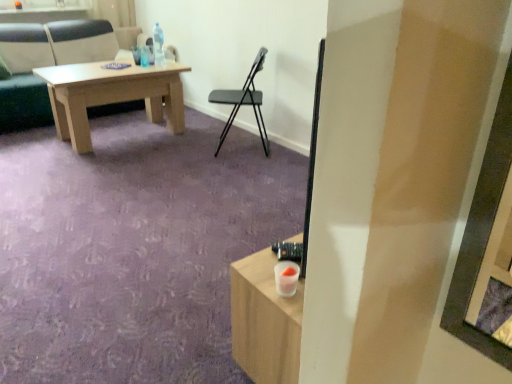
What is the approximate height of clear plastic bottle at upper center?

The height of clear plastic bottle at upper center is 13.22 inches.

Consider the image. Measure the distance between light brown wooden table at upper left, the 1th chair in the left-to-right sequence, and camera.

A distance of 3.62 meters exists between light brown wooden table at upper left, the 1th chair in the left-to-right sequence, and camera.

The height and width of the screenshot is (384, 512). What do you see at coordinates (243, 102) in the screenshot?
I see `black plastic chair at center, placed as the 2th chair when sorted from left to right` at bounding box center [243, 102].

In order to click on clear plastic bottle at upper center in this screenshot , I will do `click(158, 45)`.

From a real-world perspective, starting from the clear plastic bottle at upper center, which chair is the 2nd one below it? Please provide its 2D coordinates.

[(243, 102)]

Is black plastic chair at center, acting as the 1th chair starting from the right, far away from clear plastic bottle at upper center?

black plastic chair at center, acting as the 1th chair starting from the right, is actually quite close to clear plastic bottle at upper center.

How far apart are black plastic chair at center, which ranks as the first chair in front-to-back order, and clear plastic bottle at upper center?

black plastic chair at center, which ranks as the first chair in front-to-back order, is 75.23 centimeters from clear plastic bottle at upper center.

Which of these two, black plastic chair at center, acting as the 1th chair starting from the right, or clear plastic bottle at upper center, is wider?

Wider between the two is black plastic chair at center, acting as the 1th chair starting from the right.

How different are the orientations of light brown wooden table at upper left, which is the 2th chair from right to left, and clear plastic bottle at upper center in degrees?

The facing directions of light brown wooden table at upper left, which is the 2th chair from right to left, and clear plastic bottle at upper center are 1.16 degrees apart.

Is light brown wooden table at upper left, which is the 2th chair from right to left, placed right next to clear plastic bottle at upper center?

No, light brown wooden table at upper left, which is the 2th chair from right to left, is not with clear plastic bottle at upper center.

Looking at this image, between light brown wooden table at upper left, which is the 2th chair from right to left, and clear plastic bottle at upper center, which one has larger size?

With larger size is light brown wooden table at upper left, which is the 2th chair from right to left.

From a real-world perspective, is light brown wooden table at upper left, which is counted as the first chair, starting from the back, under clear plastic bottle at upper center?

Correct, in the physical world, light brown wooden table at upper left, which is counted as the first chair, starting from the back, is lower than clear plastic bottle at upper center.

From the image's perspective, is black plastic chair at center, acting as the 1th chair starting from the right, beneath light brown wooden table at upper left, which is counted as the first chair, starting from the back?

Yes, from the image's perspective, black plastic chair at center, acting as the 1th chair starting from the right, is below light brown wooden table at upper left, which is counted as the first chair, starting from the back.

Is the position of black plastic chair at center, placed as the 2th chair when sorted from left to right, more distant than that of light brown wooden table at upper left, marked as the 2th chair in a front-to-back arrangement?

No, it is in front of light brown wooden table at upper left, marked as the 2th chair in a front-to-back arrangement.

Does black plastic chair at center, placed as the 2th chair when sorted from left to right, have a lesser height compared to light brown wooden table at upper left, the 1th chair in the left-to-right sequence?

Yes, black plastic chair at center, placed as the 2th chair when sorted from left to right, is shorter than light brown wooden table at upper left, the 1th chair in the left-to-right sequence.

Considering the points (154, 42) and (223, 136), which point is in front, point (154, 42) or point (223, 136)?

The point (223, 136) is closer to the camera.

Is the position of clear plastic bottle at upper center more distant than that of black plastic chair at center, which ranks as the first chair in front-to-back order?

That is True.

Considering the relative positions of clear plastic bottle at upper center and black plastic chair at center, placed as the 2th chair when sorted from left to right, in the image provided, is clear plastic bottle at upper center to the right of black plastic chair at center, placed as the 2th chair when sorted from left to right, from the viewer's perspective?

Incorrect, clear plastic bottle at upper center is not on the right side of black plastic chair at center, placed as the 2th chair when sorted from left to right.

Is clear plastic bottle at upper center facing away from black plastic chair at center, placed as the 2th chair when sorted from left to right?

No, clear plastic bottle at upper center is not facing the opposite direction of black plastic chair at center, placed as the 2th chair when sorted from left to right.

Is the depth of light brown wooden table at upper left, which is counted as the first chair, starting from the back, greater than that of black plastic chair at center, acting as the 1th chair starting from the right?

Yes, it is.

Considering the relative sizes of light brown wooden table at upper left, which is the 2th chair from right to left, and black plastic chair at center, the second chair in the back-to-front sequence, in the image provided, is light brown wooden table at upper left, which is the 2th chair from right to left, thinner than black plastic chair at center, the second chair in the back-to-front sequence,?

Incorrect, the width of light brown wooden table at upper left, which is the 2th chair from right to left, is not less than that of black plastic chair at center, the second chair in the back-to-front sequence.

Is light brown wooden table at upper left, which is counted as the first chair, starting from the back, oriented away from black plastic chair at center, placed as the 2th chair when sorted from left to right?

No, light brown wooden table at upper left, which is counted as the first chair, starting from the back, is not facing away from black plastic chair at center, placed as the 2th chair when sorted from left to right.

Find the location of a particular element. chair that is the 1st one below the clear plastic bottle at upper center (from a real-world perspective) is located at coordinates (45, 64).

Between clear plastic bottle at upper center and light brown wooden table at upper left, marked as the 2th chair in a front-to-back arrangement, which one is positioned behind?

Positioned behind is clear plastic bottle at upper center.

Does point (159, 48) appear closer or farther from the camera than point (49, 112)?

Point (159, 48) is positioned closer to the camera compared to point (49, 112).

From a real-world perspective, is clear plastic bottle at upper center above or below light brown wooden table at upper left, which is counted as the first chair, starting from the back?

Clearly, from a real-world perspective, clear plastic bottle at upper center is above light brown wooden table at upper left, which is counted as the first chair, starting from the back.

There is a black plastic chair at center, the second chair in the back-to-front sequence. Where is `bottle above it (from a real-world perspective)`? The height and width of the screenshot is (384, 512). bottle above it (from a real-world perspective) is located at coordinates (158, 45).

What are the coordinates of `bottle that is below the light brown wooden table at upper left, which is counted as the first chair, starting from the back (from the image's perspective)` in the screenshot? It's located at (158, 45).

Which object lies further to the anchor point black plastic chair at center, the second chair in the back-to-front sequence, clear plastic bottle at upper center or light brown wooden table at upper left, the 1th chair in the left-to-right sequence?

light brown wooden table at upper left, the 1th chair in the left-to-right sequence, is further to black plastic chair at center, the second chair in the back-to-front sequence.

Which object lies further to the anchor point black plastic chair at center, acting as the 1th chair starting from the right, light brown wooden table at upper left, which is the 2th chair from right to left, or clear plastic bottle at upper center?

light brown wooden table at upper left, which is the 2th chair from right to left, lies further to black plastic chair at center, acting as the 1th chair starting from the right, than the other object.

From the image, which object appears to be nearer to clear plastic bottle at upper center, black plastic chair at center, which ranks as the first chair in front-to-back order, or light brown wooden table at upper left, which is the 2th chair from right to left?

Among the two, black plastic chair at center, which ranks as the first chair in front-to-back order, is located nearer to clear plastic bottle at upper center.

When comparing their distances from light brown wooden table at upper left, the 1th chair in the left-to-right sequence, does clear plastic bottle at upper center or black plastic chair at center, which ranks as the first chair in front-to-back order, seem further?

black plastic chair at center, which ranks as the first chair in front-to-back order, lies further to light brown wooden table at upper left, the 1th chair in the left-to-right sequence, than the other object.

From the image, which object appears to be farther from light brown wooden table at upper left, marked as the 2th chair in a front-to-back arrangement, black plastic chair at center, the second chair in the back-to-front sequence, or clear plastic bottle at upper center?

Among the two, black plastic chair at center, the second chair in the back-to-front sequence, is located further to light brown wooden table at upper left, marked as the 2th chair in a front-to-back arrangement.

In the scene shown: When comparing their distances from clear plastic bottle at upper center, does light brown wooden table at upper left, the 1th chair in the left-to-right sequence, or black plastic chair at center, placed as the 2th chair when sorted from left to right, seem closer?

Based on the image, black plastic chair at center, placed as the 2th chair when sorted from left to right, appears to be nearer to clear plastic bottle at upper center.

Where is `bottle situated between light brown wooden table at upper left, the 1th chair in the left-to-right sequence, and black plastic chair at center, which ranks as the first chair in front-to-back order, from left to right`? This screenshot has width=512, height=384. bottle situated between light brown wooden table at upper left, the 1th chair in the left-to-right sequence, and black plastic chair at center, which ranks as the first chair in front-to-back order, from left to right is located at coordinates (158, 45).